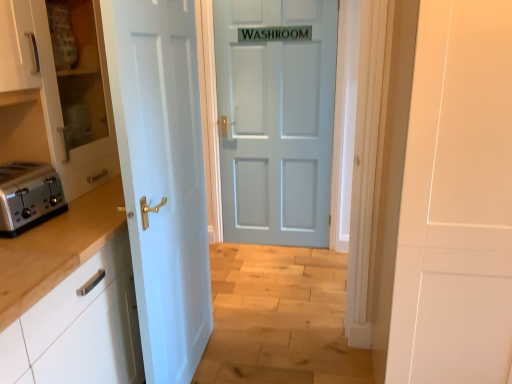
Question: From a real-world perspective, is satin silver toaster at left above or below white glossy cabinet at left, acting as the second cabinetry starting from the top?

Choices:
 (A) above
 (B) below

Answer: (A)

Question: In terms of width, does satin silver toaster at left look wider or thinner when compared to white glossy cabinet at left, acting as the second cabinetry starting from the top?

Choices:
 (A) thin
 (B) wide

Answer: (A)

Question: Which of these objects is positioned farthest from the white glossy cabinet at left, the 1th cabinetry ordered from the bottom?

Choices:
 (A) light blue matte door at center, which is the 1th door in back-to-front order
 (B) satin silver toaster at left
 (C) white glossy cabinet at left, which ranks as the 2th cabinetry in bottom-to-top order
 (D) white painted wood door at left, which ranks as the first door in front-to-back order

Answer: (A)

Question: Considering the real-world distances, which object is farthest from the light blue matte door at center, the 2th door positioned from the front?

Choices:
 (A) white painted wood door at left, positioned as the second door in back-to-front order
 (B) satin silver toaster at left
 (C) white glossy cabinet at left, acting as the second cabinetry starting from the top
 (D) white glossy cabinet at left, the first cabinetry in the top-to-bottom sequence

Answer: (C)